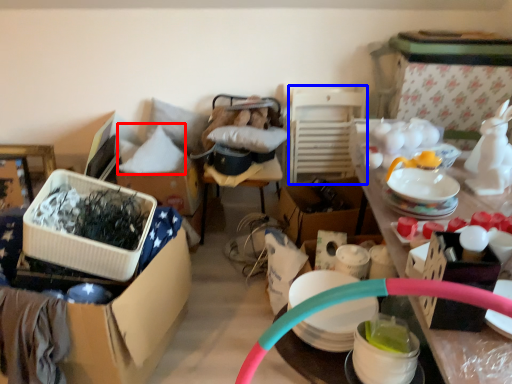
Question: Which object appears closest to the camera in this image, pillow (highlighted by a red box) or chair (highlighted by a blue box)?

Choices:
 (A) pillow
 (B) chair

Answer: (A)